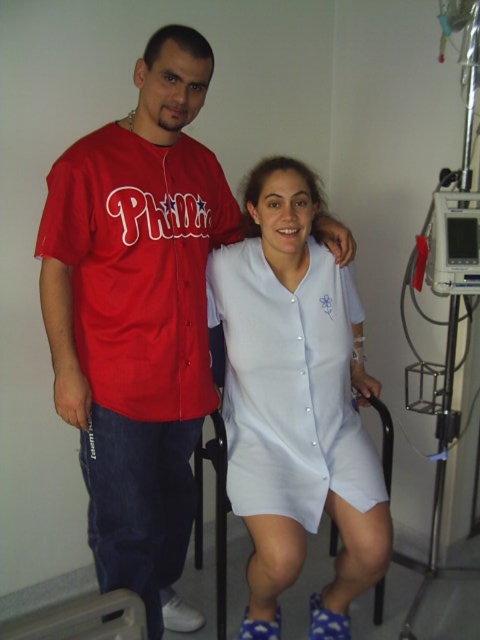
Question: Which object is positioned closest to the matte jersey at center?

Choices:
 (A) white matte hospital gown at center
 (B) matte jersey at left

Answer: (B)

Question: Can you confirm if white matte hospital gown at center is positioned below matte jersey at left?

Choices:
 (A) yes
 (B) no

Answer: (A)

Question: Which point is closer to the camera?

Choices:
 (A) matte jersey at center
 (B) matte jersey at left

Answer: (B)

Question: Can you confirm if white matte hospital gown at center is bigger than matte jersey at left?

Choices:
 (A) no
 (B) yes

Answer: (B)

Question: Which point is closer to the camera?

Choices:
 (A) white matte hospital gown at center
 (B) matte jersey at left
 (C) matte jersey at center

Answer: (B)

Question: Is matte jersey at center wider than white matte hospital gown at center?

Choices:
 (A) yes
 (B) no

Answer: (B)